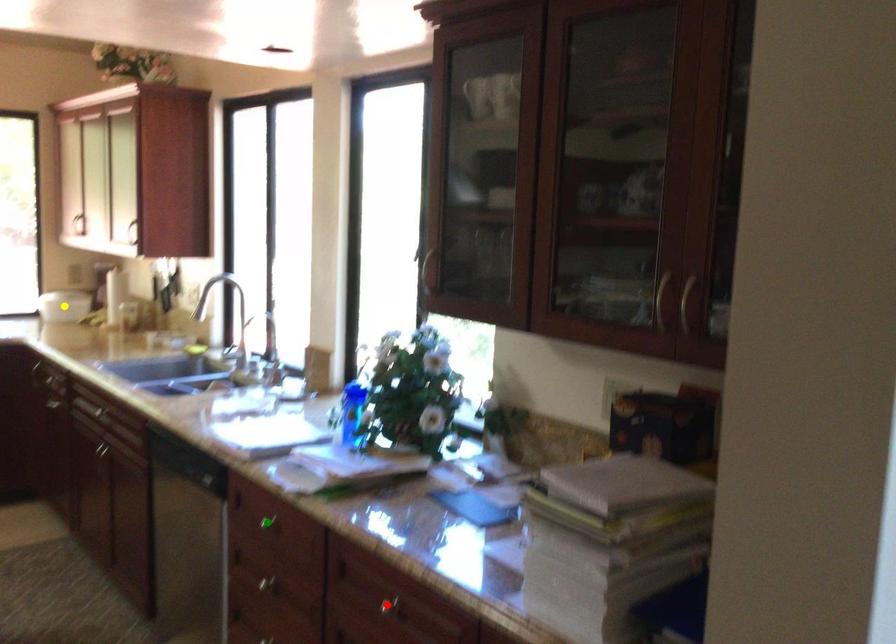
Order these from nearest to farthest:
A) red point
B) yellow point
C) green point

red point < green point < yellow point